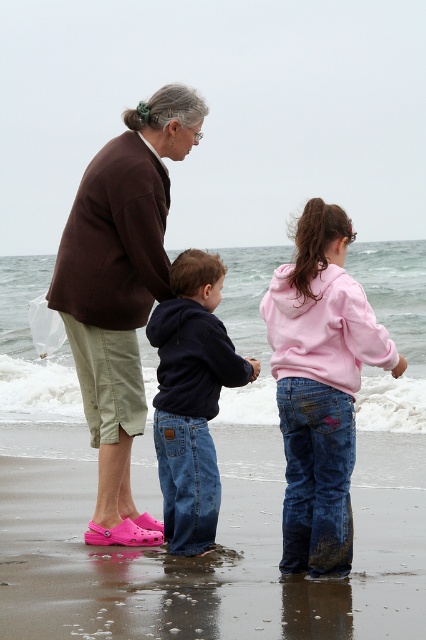
Which is above, pink fleece sweatshirt at center or dark blue hoodie at center?

pink fleece sweatshirt at center is above.

Does pink fleece sweatshirt at center appear over dark blue hoodie at center?

Yes, pink fleece sweatshirt at center is above dark blue hoodie at center.

Is point (305, 362) less distant than point (158, 420)?

That is True.

At what (x,y) coordinates should I click in order to perform the action: click on pink fleece sweatshirt at center. Please return your answer as a coordinate pair (x, y). Image resolution: width=426 pixels, height=640 pixels. Looking at the image, I should click on (319, 387).

Is brown fabric jacket at upper left to the left of pink fleece sweatshirt at center from the viewer's perspective?

Yes, brown fabric jacket at upper left is to the left of pink fleece sweatshirt at center.

Is point (115, 145) farther from viewer compared to point (305, 532)?

Yes, point (115, 145) is farther from viewer.

I want to click on brown fabric jacket at upper left, so point(120,291).

Can you confirm if pink rubber shoes at lower left is positioned below pink fleece sweatshirt at center?

Yes, pink rubber shoes at lower left is below pink fleece sweatshirt at center.

Looking at this image, measure the distance between pink rubber shoes at lower left and pink fleece sweatshirt at center.

pink rubber shoes at lower left is 7.44 feet from pink fleece sweatshirt at center.

Who is more distant from viewer, (357, 616) or (322, 349)?

The point (322, 349) is more distant.

The height and width of the screenshot is (640, 426). Find the location of `pink rubber shoes at lower left`. pink rubber shoes at lower left is located at coordinates (207, 554).